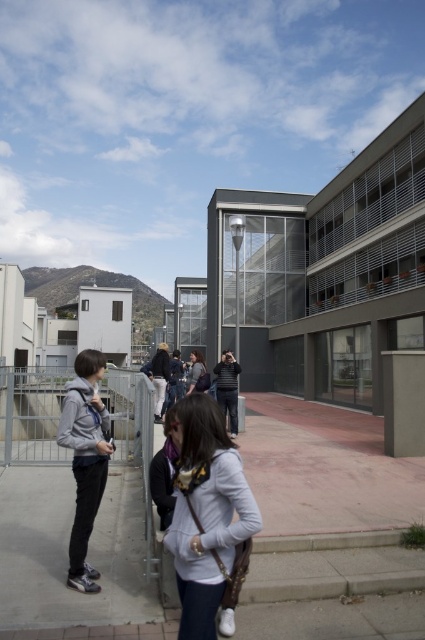
Who is more forward, (x=175, y=563) or (x=101, y=372)?

Positioned in front is point (x=175, y=563).

Is light gray fabric backpack at center smaller than gray hoodie at left?

Yes.

Where is `light gray fabric backpack at center`? The height and width of the screenshot is (640, 425). light gray fabric backpack at center is located at coordinates (206, 512).

What are the coordinates of `light gray fabric backpack at center` in the screenshot? It's located at (206, 512).

Does gray hoodie at left appear on the left side of striped sweater at center?

Yes, gray hoodie at left is to the left of striped sweater at center.

Which is in front, point (93, 436) or point (231, 426)?

Point (93, 436)

Locate an element on the screen. The width and height of the screenshot is (425, 640). gray hoodie at left is located at coordinates (85, 458).

Is light gray fabric backpack at center positioned before striped sweater at center?

Yes, light gray fabric backpack at center is closer to the viewer.

How far apart are light gray fabric backpack at center and striped sweater at center?

A distance of 7.43 meters exists between light gray fabric backpack at center and striped sweater at center.

Where is `light gray fabric backpack at center`? This screenshot has height=640, width=425. light gray fabric backpack at center is located at coordinates (206, 512).

Find the location of a particular element. light gray fabric backpack at center is located at coordinates (206, 512).